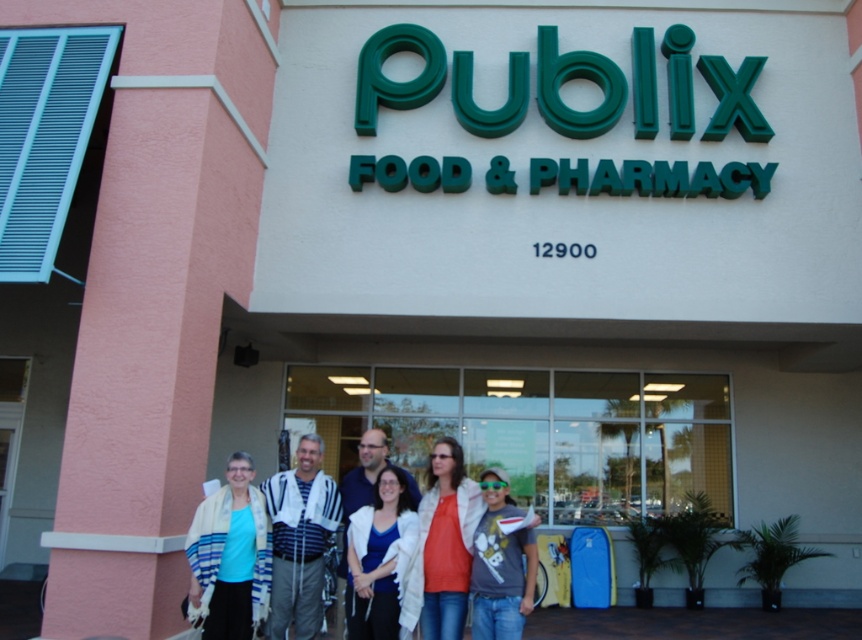
Between point (202, 595) and point (397, 618), which one is positioned behind?

Positioned behind is point (202, 595).

Does blue t-shirt at center have a lesser height compared to white matte jacket at center?

No.

Locate an element on the screen. blue t-shirt at center is located at coordinates (229, 556).

The width and height of the screenshot is (862, 640). Find the location of `blue t-shirt at center`. blue t-shirt at center is located at coordinates (229, 556).

What do you see at coordinates (298, 540) in the screenshot? The image size is (862, 640). I see `striped fabric shirt at center` at bounding box center [298, 540].

Can you confirm if striped fabric shirt at center is positioned above white matte jacket at center?

No.

Image resolution: width=862 pixels, height=640 pixels. Identify the location of striped fabric shirt at center. (298, 540).

Who is more forward, (532, 531) or (297, 586)?

Positioned in front is point (532, 531).

Does denim jeans at center appear over white textured shawl at center?

Indeed, denim jeans at center is positioned over white textured shawl at center.

Where is `denim jeans at center`? denim jeans at center is located at coordinates (500, 564).

The image size is (862, 640). Identify the location of denim jeans at center. (500, 564).